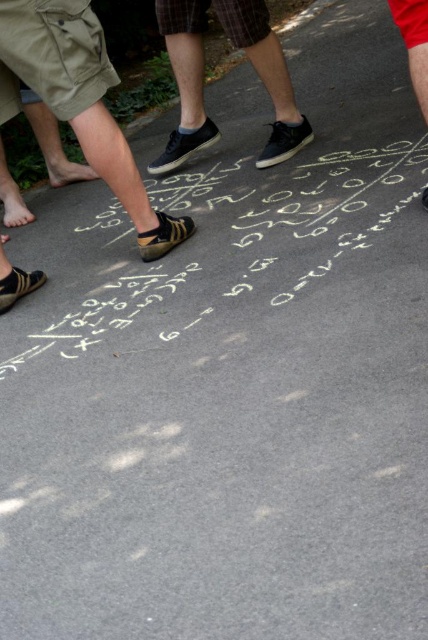
You are standing at the center of the tic tac toe board and want to place your mark on the point closest to you. Which point should you choose between point (261, 211) and point (291, 122)?

Point (261, 211) is closer to the camera than point (291, 122), so you should choose point (261, 211).

You are standing at the center of the tic tac toe board and want to move towards the point closer to you. Which point should you move towards, point (17,16) or point (252,8)?

Answer: You should move towards point (17,16) because it is closer to you than point (252,8).